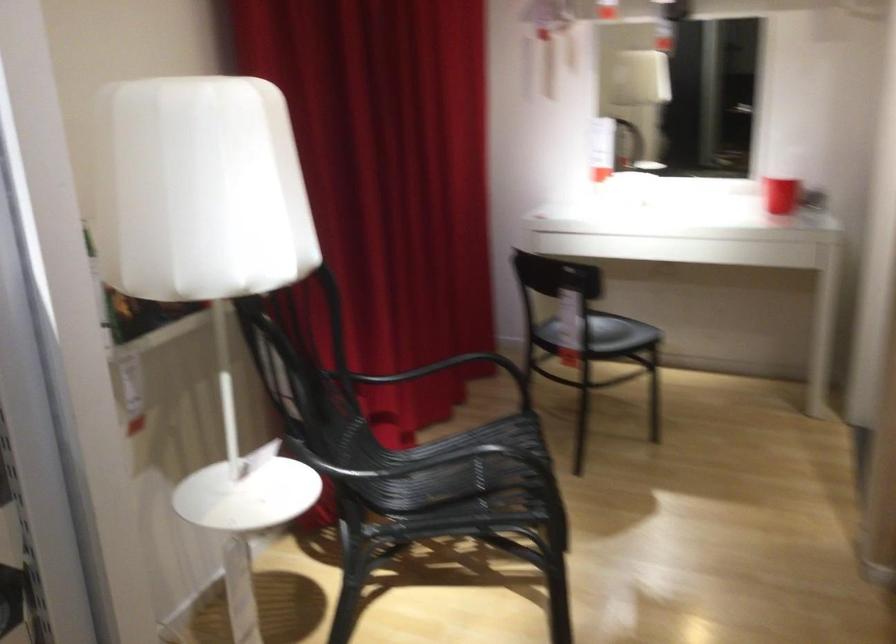
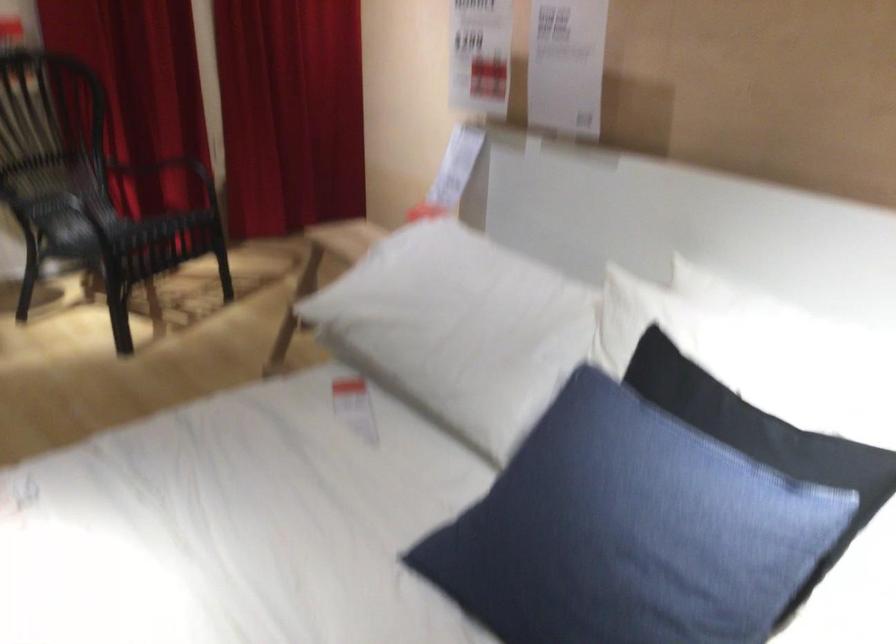
Question: Which direction would the cameraman need to move to produce the second image? Reply with the corresponding letter.

Choices:
 (A) Left
 (B) Right
 (C) Forward
 (D) Backward

Answer: (B)